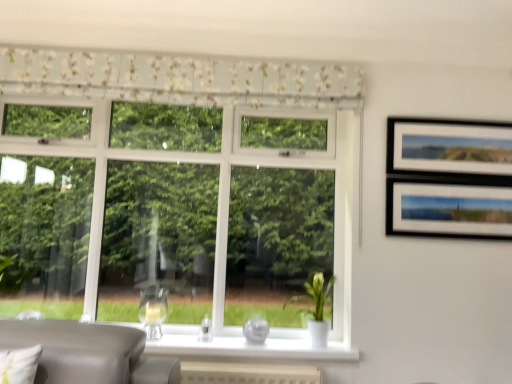
Locate an element on the screen. The width and height of the screenshot is (512, 384). transparent glass vase at center is located at coordinates (256, 331).

Locate an element on the screen. The height and width of the screenshot is (384, 512). floral fabric valance at upper center is located at coordinates (179, 78).

Is white glossy vase at lower center smaller than floral fabric valance at upper center?

Correct, white glossy vase at lower center occupies less space than floral fabric valance at upper center.

What's the angular difference between white glossy vase at lower center and floral fabric valance at upper center's facing directions?

The facing directions of white glossy vase at lower center and floral fabric valance at upper center are 1.22 degrees apart.

From the image's perspective, relative to floral fabric valance at upper center, is white glossy vase at lower center above or below?

Based on their image positions, white glossy vase at lower center is located beneath floral fabric valance at upper center.

Does floral fabric valance at upper center have a lesser width compared to white glossy vase at lower center?

Yes.

Would you say floral fabric valance at upper center is to the left or to the right of white glossy vase at lower center in the picture?

In the image, floral fabric valance at upper center appears on the left side of white glossy vase at lower center.

From the image's perspective, which one is positioned higher, transparent glass vase at center or white glossy vase at lower center?

From the image's view, white glossy vase at lower center is above.

From a real-world perspective, which object stands above the other?

From a 3D spatial view, white glossy vase at lower center is above.

Can you tell me how much transparent glass vase at center and white glossy vase at lower center differ in facing direction?

The angular difference between transparent glass vase at center and white glossy vase at lower center is 0.00128 degrees.

Is transparent glass vase at center oriented towards white glossy vase at lower center?

No, transparent glass vase at center is not oriented towards white glossy vase at lower center.

Is white glossy vase at lower center bigger or smaller than transparent glass vase at center?

In the image, white glossy vase at lower center appears to be larger than transparent glass vase at center.

Is white glossy vase at lower center taller or shorter than transparent glass vase at center?

Clearly, white glossy vase at lower center is taller compared to transparent glass vase at center.

Between white glossy vase at lower center and transparent glass vase at center, which one appears on the right side from the viewer's perspective?

white glossy vase at lower center.

Is floral fabric valance at upper center not inside transparent glass vase at center?

Yes, floral fabric valance at upper center is located beyond the bounds of transparent glass vase at center.

Who is shorter, floral fabric valance at upper center or transparent glass vase at center?

transparent glass vase at center is shorter.

Is floral fabric valance at upper center not close to transparent glass vase at center?

Indeed, floral fabric valance at upper center is not near transparent glass vase at center.

Is floral fabric valance at upper center positioned in front of transparent glass vase at center?

Yes, it is in front of transparent glass vase at center.

Considering their positions, is transparent glass vase at center located in front of or behind floral fabric valance at upper center?

Visually, transparent glass vase at center is located behind floral fabric valance at upper center.

Measure the distance from transparent glass vase at center to floral fabric valance at upper center.

transparent glass vase at center and floral fabric valance at upper center are 4.93 feet apart from each other.

Locate an element on the screen. curtain on the left of transparent glass vase at center is located at coordinates (179, 78).

At what (x,y) coordinates should I click in order to perform the action: click on plant on the right of floral fabric valance at upper center. Please return your answer as a coordinate pair (x, y). Looking at the image, I should click on (315, 294).

Identify the location of curtain located behind the white glossy vase at lower center. The height and width of the screenshot is (384, 512). (179, 78).

Based on their spatial positions, is white glossy vase at lower center or transparent glass vase at center closer to floral fabric valance at upper center?

white glossy vase at lower center is positioned closer to the anchor floral fabric valance at upper center.

Based on their spatial positions, is transparent glass vase at center or floral fabric valance at upper center further from white glossy vase at lower center?

The object further to white glossy vase at lower center is floral fabric valance at upper center.

In the scene shown: Based on their spatial positions, is transparent glass vase at center or white glossy vase at lower center further from floral fabric valance at upper center?

The object further to floral fabric valance at upper center is transparent glass vase at center.

When comparing their distances from white glossy vase at lower center, does floral fabric valance at upper center or transparent glass vase at center seem closer?

transparent glass vase at center is positioned closer to the anchor white glossy vase at lower center.

From the image, which object appears to be farther from transparent glass vase at center, white glossy vase at lower center or floral fabric valance at upper center?

Among the two, floral fabric valance at upper center is located further to transparent glass vase at center.

Looking at the image, which one is located closer to transparent glass vase at center, floral fabric valance at upper center or white glossy vase at lower center?

white glossy vase at lower center is closer to transparent glass vase at center.

Identify the location of plant between floral fabric valance at upper center and transparent glass vase at center from top to bottom. Image resolution: width=512 pixels, height=384 pixels. [315, 294].